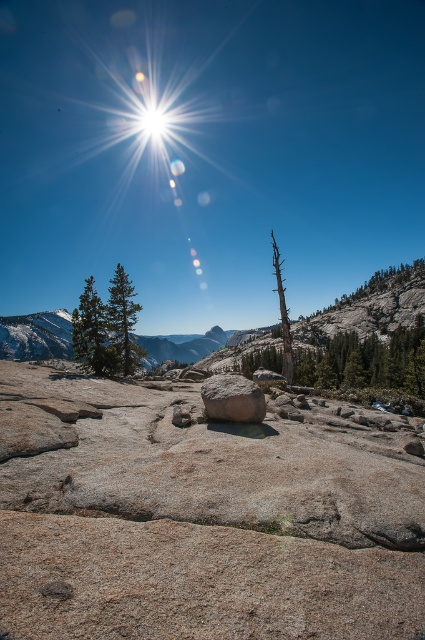
Which is behind, point (104, 348) or point (217, 384)?

The point (104, 348) is more distant.

Is point (76, 316) less distant than point (235, 376)?

No, (76, 316) is further to viewer.

Is point (107, 337) closer to camera compared to point (214, 413)?

No.

I want to click on green matte tree at left, so click(91, 332).

Does gray granite mountain at lower left have a greater width compared to green matte tree at left?

Indeed, gray granite mountain at lower left has a greater width compared to green matte tree at left.

Does point (204, 340) come behind point (90, 337)?

Yes, it is behind point (90, 337).

This screenshot has height=640, width=425. In order to click on gray granite mountain at lower left in this screenshot , I will do `click(36, 336)`.

Where is `gray granite mountain at lower left`? gray granite mountain at lower left is located at coordinates (36, 336).

Who is positioned more to the right, green matte tree at left or green matte tree at upper left?

From the viewer's perspective, green matte tree at left appears more on the right side.

This screenshot has height=640, width=425. What do you see at coordinates (91, 332) in the screenshot?
I see `green matte tree at left` at bounding box center [91, 332].

Who is more distant from viewer, (76,320) or (108,305)?

The point (108,305) is more distant.

Find the location of a particular element. The height and width of the screenshot is (640, 425). green matte tree at left is located at coordinates (91, 332).